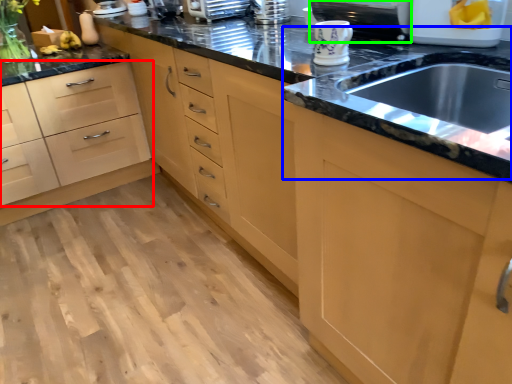
Question: Estimate the real-world distances between objects in this image. Which object is farther from drawer (highlighted by a red box), sink (highlighted by a blue box) or appliance (highlighted by a green box)?

Choices:
 (A) sink
 (B) appliance

Answer: (A)